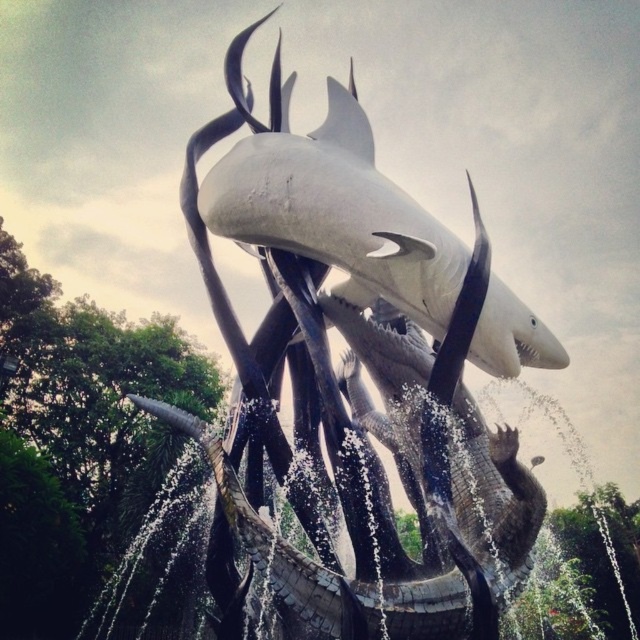
You are an art curator examining the sculpture. You notice two sharks in the sculpture. Which shark is closer to you, the white glossy shark at center or the white matte shark at upper center?

The white glossy shark at center is closer to you because it is positioned in front of the white matte shark at upper center.

You are an art installer who needs to place a 1.5 meter long decorative pole between the white glossy shark at center and the white matte shark at upper center. Is there enough space to fit the pole between them?

The distance between the white glossy shark at center and the white matte shark at upper center is 1.43 meters. Since the pole is 1.5 meters long, it is slightly longer than the available space. Therefore, the pole cannot be placed between them without overlapping.